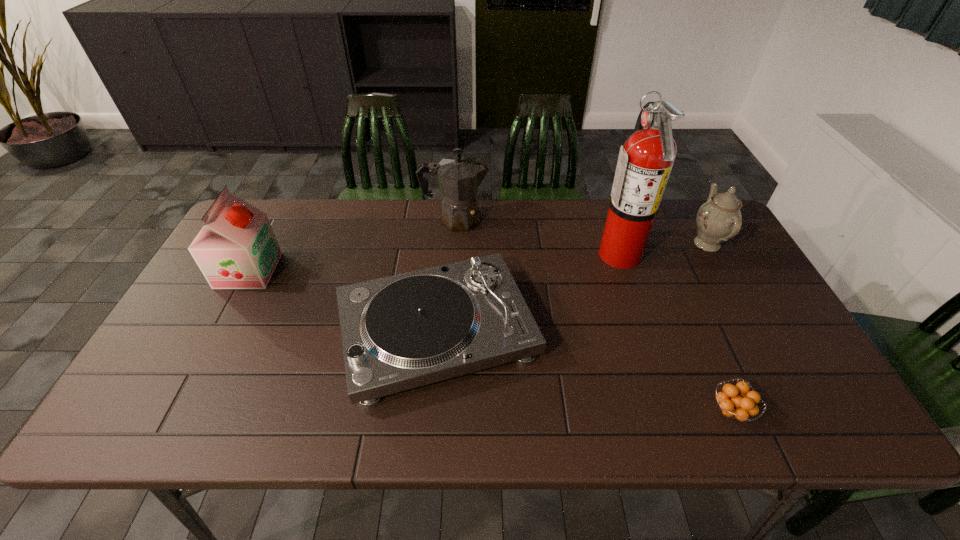
Image resolution: width=960 pixels, height=540 pixels. I want to click on free space that satisfies the following two spatial constraints: 1. with the cap open on the second shortest object; 2. on the right side of the soya milk, so 216,332.

Identify the location of vacant area that satisfies the following two spatial constraints: 1. on the pouring side of the shortest object; 2. on the right side of the coffeepot. This screenshot has width=960, height=540. (444, 411).

Locate an element on the screen. free space that satisfies the following two spatial constraints: 1. on the back side of the orange fruit; 2. on the nozzle side of the third object from right to left is located at coordinates (662, 253).

The image size is (960, 540). Identify the location of vacant space that satisfies the following two spatial constraints: 1. on the spout of the rightmost object; 2. on the front side of the second shortest object. (756, 332).